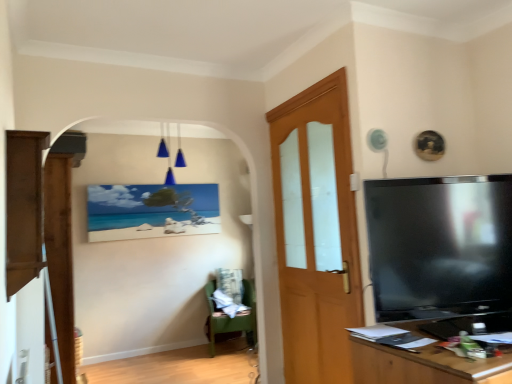
Find the location of a particular element. Image resolution: width=512 pixels, height=384 pixels. black glossy tv at right is located at coordinates (440, 245).

Measure the distance between point (294, 372) and camera.

A distance of 9.31 feet exists between point (294, 372) and camera.

The height and width of the screenshot is (384, 512). Describe the element at coordinates (424, 366) in the screenshot. I see `wooden desk at right` at that location.

Locate an element on the screen. wooden desk at right is located at coordinates (424, 366).

Image resolution: width=512 pixels, height=384 pixels. I want to click on matte canvas painting at center, so click(x=151, y=211).

Locate an element on the screen. Image resolution: width=512 pixels, height=384 pixels. brown wood cabinet at left is located at coordinates (24, 207).

Is matte canvas painting at center bigger or smaller than wooden door at center?

In the image, matte canvas painting at center appears to be smaller than wooden door at center.

From a real-world perspective, is matte canvas painting at center on wooden door at center?

Yes, from a real-world perspective, matte canvas painting at center is on top of wooden door at center.

Is wooden door at center at the back of matte canvas painting at center?

matte canvas painting at center is not turned away from wooden door at center.

Based on the photo, from the image's perspective, which one is positioned higher, matte canvas painting at center or wooden door at center?

matte canvas painting at center is shown above in the image.

From the image's perspective, relative to brown wood cabinet at left, is blue glass light fixture at upper center above or below?

blue glass light fixture at upper center is situated higher than brown wood cabinet at left in the image.

In the image, there is a blue glass light fixture at upper center. Where is `cabinetry below it (from the image's perspective)`? The width and height of the screenshot is (512, 384). cabinetry below it (from the image's perspective) is located at coordinates (24, 207).

Is point (182, 152) farther from viewer compared to point (35, 193)?

That is True.

Is black glossy tv at right wider than brown wood cabinet at left?

Yes.

How many degrees apart are the facing directions of black glossy tv at right and brown wood cabinet at left?

black glossy tv at right and brown wood cabinet at left are facing 107 degrees away from each other.

In the scene shown: From a real-world perspective, which object stands above the other?

From a 3D spatial view, brown wood cabinet at left is above.

Between black glossy tv at right and brown wood cabinet at left, which one appears on the left side from the viewer's perspective?

Positioned to the left is brown wood cabinet at left.

Consider the image. Which is in front, blue glass light fixture at upper center or green fabric chair at lower left?

blue glass light fixture at upper center is in front.

Does point (180, 166) come farther from viewer compared to point (252, 307)?

Yes, point (180, 166) is farther from viewer.

Which of these two, blue glass light fixture at upper center or green fabric chair at lower left, is thinner?

With smaller width is blue glass light fixture at upper center.

From a real-world perspective, which is physically above, blue glass light fixture at upper center or green fabric chair at lower left?

blue glass light fixture at upper center.

Where is `light fixture above the wooden desk at right (from a real-world perspective)`? light fixture above the wooden desk at right (from a real-world perspective) is located at coordinates (168, 161).

Is wooden desk at right shorter than blue glass light fixture at upper center?

Correct, wooden desk at right is not as tall as blue glass light fixture at upper center.

Would you say wooden desk at right is outside blue glass light fixture at upper center?

Indeed, wooden desk at right is completely outside blue glass light fixture at upper center.

This screenshot has width=512, height=384. I want to click on picture frame located behind the black glossy tv at right, so click(151, 211).

Considering the positions of objects matte canvas painting at center and black glossy tv at right in the image provided, who is more to the right, matte canvas painting at center or black glossy tv at right?

black glossy tv at right is more to the right.

How different are the orientations of matte canvas painting at center and black glossy tv at right in degrees?

matte canvas painting at center and black glossy tv at right are facing 16.4 degrees away from each other.

Is brown wood cabinet at left shorter than black glossy tv at right?

In fact, brown wood cabinet at left may be taller than black glossy tv at right.

How distant is brown wood cabinet at left from black glossy tv at right?

brown wood cabinet at left is 5.48 feet away from black glossy tv at right.

Is brown wood cabinet at left oriented towards black glossy tv at right?

No, brown wood cabinet at left is not facing towards black glossy tv at right.

Can you confirm if brown wood cabinet at left is smaller than black glossy tv at right?

Correct, brown wood cabinet at left occupies less space than black glossy tv at right.

Identify the location of picture frame above the wooden door at center (from a real-world perspective). Image resolution: width=512 pixels, height=384 pixels. (151, 211).

Image resolution: width=512 pixels, height=384 pixels. In the image, there is a brown wood cabinet at left. What are the coordinates of `light fixture above it (from the image's perspective)` in the screenshot? It's located at (168, 161).

Which object lies further to the anchor point green fabric chair at lower left, black glossy tv at right or matte canvas painting at center?

Among the two, black glossy tv at right is located further to green fabric chair at lower left.

From the image, which object appears to be nearer to brown wood cabinet at left, matte canvas painting at center or wooden desk at right?

wooden desk at right lies closer to brown wood cabinet at left than the other object.

Estimate the real-world distances between objects in this image. Which object is closer to blue glass light fixture at upper center, black glossy tv at right or green fabric chair at lower left?

Based on the image, green fabric chair at lower left appears to be nearer to blue glass light fixture at upper center.

Based on their spatial positions, is green fabric chair at lower left or wooden door at center further from blue glass light fixture at upper center?

wooden door at center lies further to blue glass light fixture at upper center than the other object.

Considering their positions, is blue glass light fixture at upper center positioned closer to matte canvas painting at center than brown wood cabinet at left?

blue glass light fixture at upper center.

When comparing their distances from green fabric chair at lower left, does black glossy tv at right or wooden desk at right seem closer?

wooden desk at right lies closer to green fabric chair at lower left than the other object.

Estimate the real-world distances between objects in this image. Which object is closer to brown wood cabinet at left, green fabric chair at lower left or wooden desk at right?

wooden desk at right.

When comparing their distances from brown wood cabinet at left, does wooden desk at right or matte canvas painting at center seem closer?

Among the two, wooden desk at right is located nearer to brown wood cabinet at left.

The height and width of the screenshot is (384, 512). I want to click on door between black glossy tv at right and green fabric chair at lower left along the z-axis, so click(316, 232).

Image resolution: width=512 pixels, height=384 pixels. What are the coordinates of `light fixture between wooden door at center and matte canvas painting at center along the z-axis` in the screenshot? It's located at (168, 161).

Identify the location of television between wooden desk at right and wooden door at center along the z-axis. (440, 245).

The height and width of the screenshot is (384, 512). Identify the location of chair between black glossy tv at right and matte canvas painting at center in the front-back direction. tap(230, 318).